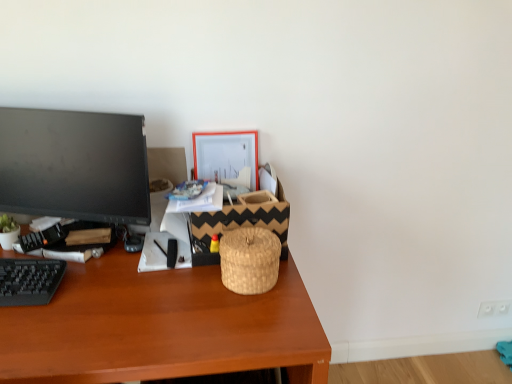
Describe the element at coordinates (160, 327) in the screenshot. The height and width of the screenshot is (384, 512). I see `brown wooden desk at center` at that location.

I want to click on black plastic keyboard at lower left, so click(29, 281).

Locate an element on the screen. This screenshot has height=384, width=512. black glossy monitor at left is located at coordinates (74, 165).

This screenshot has width=512, height=384. Identify the location of woven natural basket at center, the second basket from the back. (249, 260).

How different are the orientations of black glossy monitor at left and brown wooden desk at center in degrees?

The angle between the facing direction of black glossy monitor at left and the facing direction of brown wooden desk at center is 17 degrees.

Is black glossy monitor at left directly adjacent to brown wooden desk at center?

black glossy monitor at left is not next to brown wooden desk at center, and they're not touching.

In the image, is black glossy monitor at left positioned in front of or behind brown wooden desk at center?

Visually, black glossy monitor at left is located behind brown wooden desk at center.

From the image's perspective, is black glossy monitor at left over brown wooden desk at center?

Yes, from the image's perspective, black glossy monitor at left is on top of brown wooden desk at center.

Between woven natural basket at center, the first basket in the front-to-back sequence, and woven straw basket at center, which is the second basket in front-to-back order, which one is positioned behind?

woven straw basket at center, which is the second basket in front-to-back order.

Which is more to the right, woven natural basket at center, the first basket in the front-to-back sequence, or woven straw basket at center, which is the second basket in front-to-back order?

woven natural basket at center, the first basket in the front-to-back sequence, is more to the right.

From the image's perspective, between woven natural basket at center, the first basket in the front-to-back sequence, and woven straw basket at center, which is the second basket in front-to-back order, who is located below?

woven natural basket at center, the first basket in the front-to-back sequence, from the image's perspective.

Based on the photo, considering the sizes of objects woven natural basket at center, the second basket from the back, and woven straw basket at center, which is the second basket in front-to-back order, in the image provided, who is wider, woven natural basket at center, the second basket from the back, or woven straw basket at center, which is the second basket in front-to-back order,?

woven straw basket at center, which is the second basket in front-to-back order.

Looking at this image, does brown wooden desk at center appear on the left side of black glossy monitor at left?

No.

From the image's perspective, which object appears higher, brown wooden desk at center or black glossy monitor at left?

black glossy monitor at left is shown above in the image.

Is brown wooden desk at center situated inside black glossy monitor at left or outside?

brown wooden desk at center is located beyond the bounds of black glossy monitor at left.

Would you consider brown wooden desk at center to be distant from black glossy monitor at left?

No, there isn't a large distance between brown wooden desk at center and black glossy monitor at left.

Are woven straw basket at center, which is the second basket in front-to-back order, and orange matte picture frame at upper center far apart?

That's not correct — woven straw basket at center, which is the second basket in front-to-back order, is a little close to orange matte picture frame at upper center.

From the image's perspective, would you say woven straw basket at center, which is the second basket in front-to-back order, is positioned over orange matte picture frame at upper center?

No, from the image's perspective, woven straw basket at center, which is the second basket in front-to-back order, is not over orange matte picture frame at upper center.

Could you tell me if woven straw basket at center, marked as the 1th basket in a back-to-front arrangement, is facing orange matte picture frame at upper center?

No.

Identify the location of computer keyboard lying in front of the woven straw basket at center, marked as the 1th basket in a back-to-front arrangement. (29, 281).

Does black plastic keyboard at lower left turn towards woven straw basket at center, marked as the 1th basket in a back-to-front arrangement?

No, black plastic keyboard at lower left is not aimed at woven straw basket at center, marked as the 1th basket in a back-to-front arrangement.

Which is in front, point (30, 264) or point (257, 213)?

The point (30, 264) is more forward.

From a real-world perspective, is black plastic keyboard at lower left positioned under woven straw basket at center, which is the second basket in front-to-back order, based on gravity?

Yes, from a real-world perspective, black plastic keyboard at lower left is beneath woven straw basket at center, which is the second basket in front-to-back order.

Is woven straw basket at center, marked as the 1th basket in a back-to-front arrangement, shorter than woven natural basket at center, the first basket in the front-to-back sequence?

In fact, woven straw basket at center, marked as the 1th basket in a back-to-front arrangement, may be taller than woven natural basket at center, the first basket in the front-to-back sequence.

Considering the points (241, 207) and (275, 279), which point is in front, point (241, 207) or point (275, 279)?

The point (275, 279) is more forward.

From the picture: Which of these two, orange matte picture frame at upper center or black plastic keyboard at lower left, is bigger?

orange matte picture frame at upper center.

How far apart are orange matte picture frame at upper center and black plastic keyboard at lower left?

23.76 inches.

Considering the relative positions of orange matte picture frame at upper center and black plastic keyboard at lower left in the image provided, is orange matte picture frame at upper center behind black plastic keyboard at lower left?

Yes, it is behind black plastic keyboard at lower left.

Which object is positioned more to the left, orange matte picture frame at upper center or black plastic keyboard at lower left?

Positioned to the left is black plastic keyboard at lower left.

You are a GUI agent. You are given a task and a screenshot of the screen. Output one action in this format:
    pyautogui.click(x=<x>, y=<y>)
    Task: Click on the television above the brown wooden desk at center (from a real-world perspective)
    Image resolution: width=512 pixels, height=384 pixels.
    Given the screenshot: What is the action you would take?
    pyautogui.click(x=74, y=165)

Find the location of a particular element. basket that appears behind the woven natural basket at center, the first basket in the front-to-back sequence is located at coordinates (237, 225).

Estimate the real-world distances between objects in this image. Which object is closer to woven natural basket at center, the second basket from the back, black plastic keyboard at lower left or orange matte picture frame at upper center?

orange matte picture frame at upper center.

Based on their spatial positions, is orange matte picture frame at upper center or woven natural basket at center, the second basket from the back, closer to woven straw basket at center, which is the second basket in front-to-back order?

woven natural basket at center, the second basket from the back, is positioned closer to the anchor woven straw basket at center, which is the second basket in front-to-back order.

Looking at the image, which one is located further to orange matte picture frame at upper center, woven straw basket at center, marked as the 1th basket in a back-to-front arrangement, or woven natural basket at center, the second basket from the back?

Based on the image, woven natural basket at center, the second basket from the back, appears to be further to orange matte picture frame at upper center.

Based on their spatial positions, is woven straw basket at center, which is the second basket in front-to-back order, or orange matte picture frame at upper center further from brown wooden desk at center?

orange matte picture frame at upper center is further to brown wooden desk at center.

From the image, which object appears to be nearer to woven natural basket at center, the first basket in the front-to-back sequence, black plastic keyboard at lower left or brown wooden desk at center?

Based on the image, brown wooden desk at center appears to be nearer to woven natural basket at center, the first basket in the front-to-back sequence.

Estimate the real-world distances between objects in this image. Which object is further from black plastic keyboard at lower left, orange matte picture frame at upper center or woven natural basket at center, the second basket from the back?

orange matte picture frame at upper center.

Looking at the image, which one is located closer to black plastic keyboard at lower left, brown wooden desk at center or black glossy monitor at left?

Among the two, brown wooden desk at center is located nearer to black plastic keyboard at lower left.

Looking at the image, which one is located further to brown wooden desk at center, orange matte picture frame at upper center or woven straw basket at center, which is the second basket in front-to-back order?

The object further to brown wooden desk at center is orange matte picture frame at upper center.

Locate an element on the screen. basket between woven straw basket at center, which is the second basket in front-to-back order, and brown wooden desk at center, in the vertical direction is located at coordinates (249, 260).

This screenshot has height=384, width=512. I want to click on basket between woven natural basket at center, the first basket in the front-to-back sequence, and orange matte picture frame at upper center, along the z-axis, so click(x=237, y=225).

Where is `television between orange matte picture frame at upper center and brown wooden desk at center in the up-down direction`? This screenshot has height=384, width=512. television between orange matte picture frame at upper center and brown wooden desk at center in the up-down direction is located at coordinates (74, 165).

You are a GUI agent. You are given a task and a screenshot of the screen. Output one action in this format:
    pyautogui.click(x=<x>, y=<y>)
    Task: Click on the picture frame located between black glossy monitor at left and woven natural basket at center, the first basket in the front-to-back sequence, in the left-right direction
    
    Given the screenshot: What is the action you would take?
    pyautogui.click(x=226, y=155)